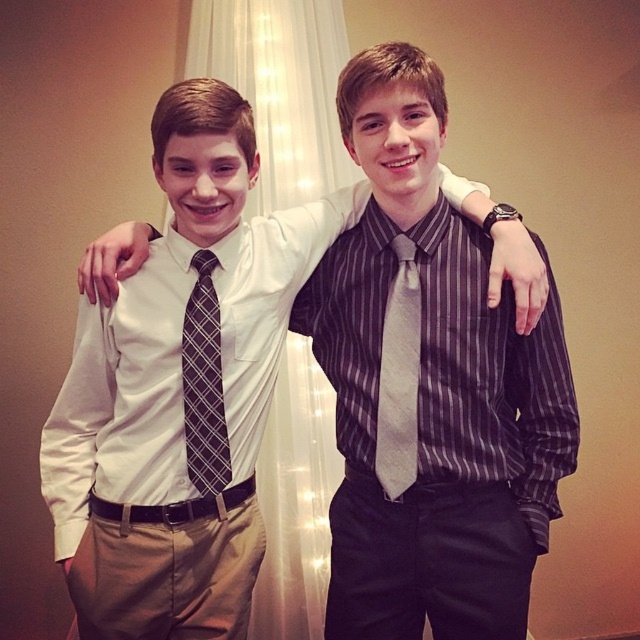
Based on the photo, you are a photographer standing at point (301, 90). You want to take a photo of the two people. Can you fit both of them in your camera frame which has a 2.5 meter width?

The two people are 2.46 meters apart, so yes, the photographer can fit both of them in the camera frame since the distance between them is less than the frame width of 2.5 meters.

You are a photographer trying to focus on the silky gray tie at center and the plaid fabric tie at center in the image. Which tie is positioned higher in the frame?

The silky gray tie at center is located above the plaid fabric tie at center, so it is positioned higher in the frame.

You are a photographer adjusting the camera settings to ensure both the silky gray tie at center and the plaid fabric tie at center are in focus. Given that the camera has a depth of field that can cover objects within a 35 cm range, will both ties be in focus?

The silky gray tie at center is 37.34 centimeters away from the plaid fabric tie at center. Since the distance between them exceeds the camera sensor depth of field range of 35 cm, both ties cannot be in focus simultaneously.